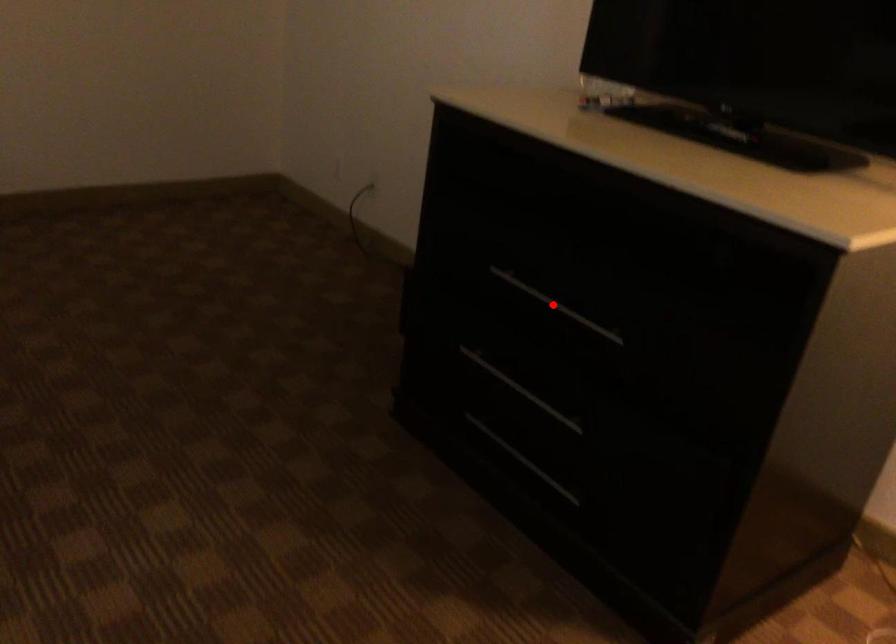
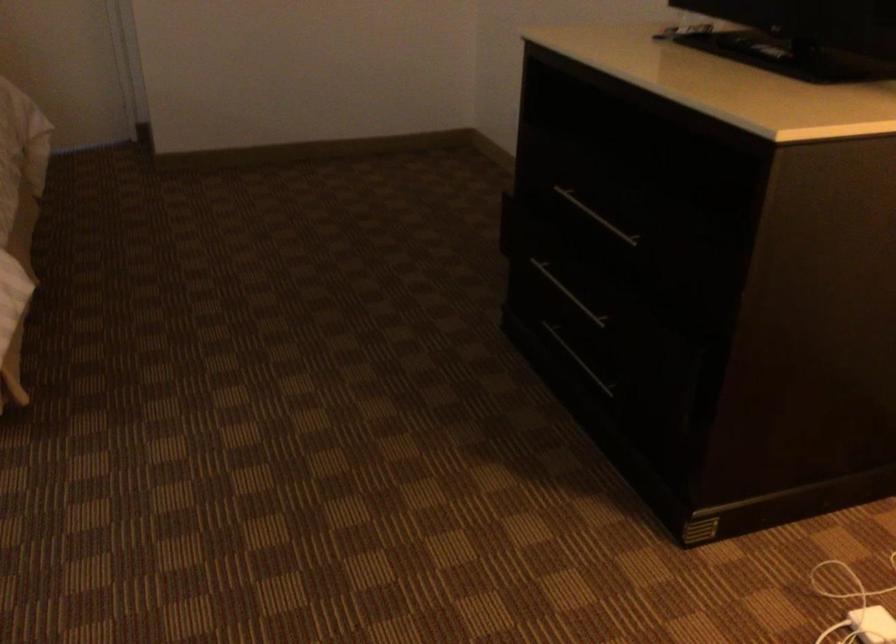
In the second image, find the point that corresponds to the highlighted location in the first image.

(596, 216)